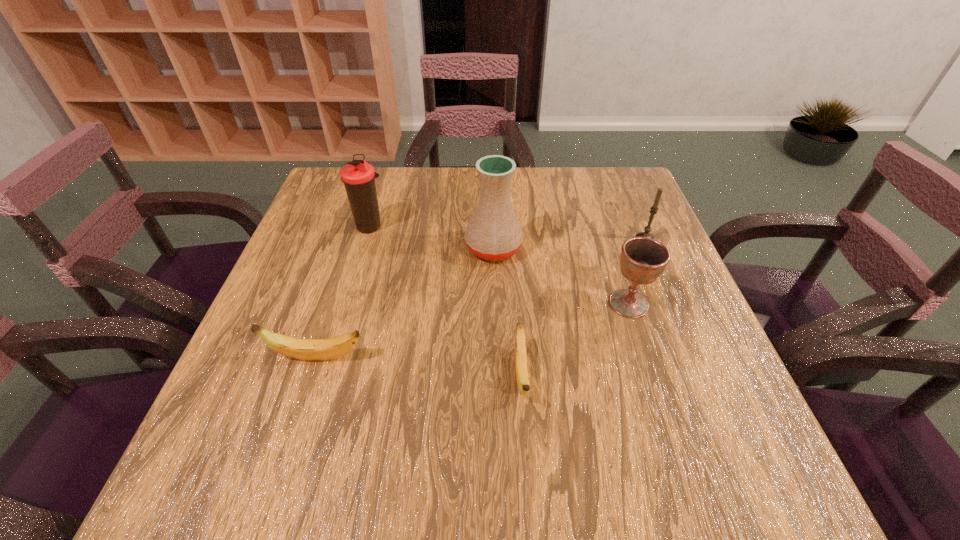
At what (x,y) coordinates should I click in order to perform the action: click on vacant space at the left edge of the desktop. Please return your answer as a coordinate pair (x, y). Image resolution: width=960 pixels, height=540 pixels. Looking at the image, I should click on (304, 367).

In the image, there is a desktop. Find the location of `vacant space at the right edge`. vacant space at the right edge is located at coordinates (644, 352).

In the image, there is a desktop. In order to click on free space at the far right corner in this screenshot , I will do `click(628, 184)`.

You are a GUI agent. You are given a task and a screenshot of the screen. Output one action in this format:
    pyautogui.click(x=<x>, y=<y>)
    Task: Click on the empty space between the taller banana and the second object from right to left
    This screenshot has height=540, width=960.
    Given the screenshot: What is the action you would take?
    pyautogui.click(x=472, y=330)

Where is `free spot between the fifth shortest object and the pottery`? The height and width of the screenshot is (540, 960). free spot between the fifth shortest object and the pottery is located at coordinates (432, 237).

Locate an element on the screen. The height and width of the screenshot is (540, 960). blank region between the rightmost object and the taller banana is located at coordinates (481, 298).

In order to click on vacant area between the second object from right to left and the pottery in this screenshot , I will do coord(561,276).

The height and width of the screenshot is (540, 960). I want to click on blank region between the taller banana and the rightmost object, so click(x=481, y=298).

Find the location of `free space between the pottery and the taller banana`. free space between the pottery and the taller banana is located at coordinates (405, 303).

At what (x,y) coordinates should I click in order to perform the action: click on vacant space that is in between the fourth farthest object and the right banana. Please return your answer as a coordinate pair (x, y). Looking at the image, I should click on (575, 339).